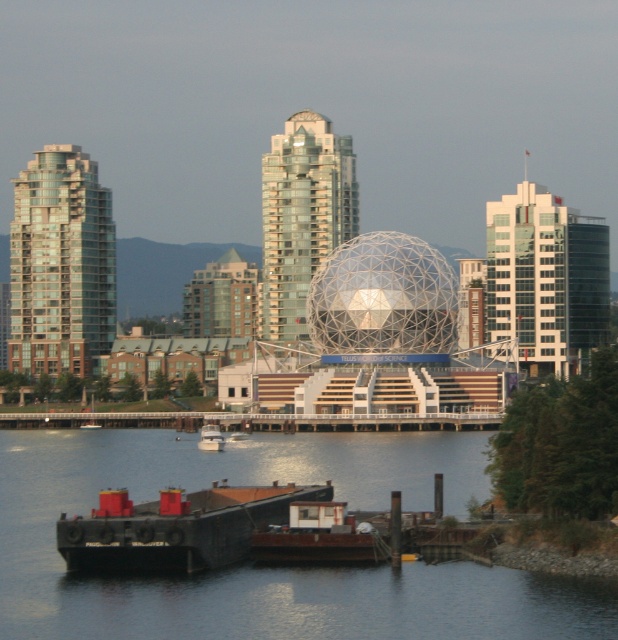
Question: Which point is closer to the camera?

Choices:
 (A) (64, 458)
 (B) (221, 448)
 (C) (420, 344)
 (D) (290, 486)

Answer: (D)

Question: Does transparent glass dome at center have a smaller size compared to rustic wood boat at lower center?

Choices:
 (A) no
 (B) yes

Answer: (A)

Question: Which point is closer to the camera?

Choices:
 (A) (124, 625)
 (B) (373, 310)

Answer: (A)

Question: Is transparent glass dome at center bigger than rustic wood boat at lower center?

Choices:
 (A) yes
 (B) no

Answer: (A)

Question: Does dark blue water at lower center have a lesser width compared to rustic wood boat at lower center?

Choices:
 (A) yes
 (B) no

Answer: (B)

Question: Among these points, which one is farthest from the camera?

Choices:
 (A) (211, 428)
 (B) (80, 522)
 (C) (292, 557)

Answer: (A)